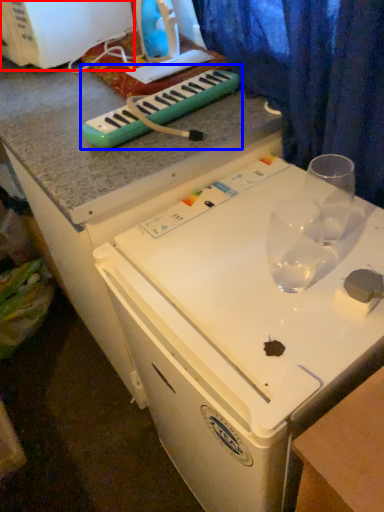
Question: Which point is further to the camera, appliance (highlighted by a red box) or musical keyboard (highlighted by a blue box)?

Choices:
 (A) appliance
 (B) musical keyboard

Answer: (A)